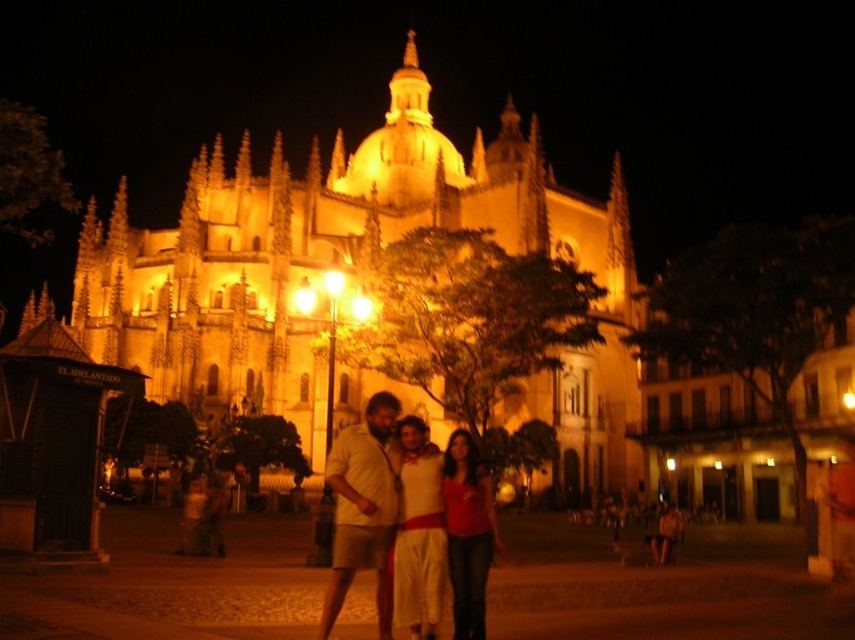
You are a photographer trying to capture a group photo of the white cotton dress at center and the matte beige shirt at center. Which of the two should you focus on first if you want to ensure both are in frame without cropping?

The white cotton dress at center occupies less space than matte beige shirt at center, so you should focus on the matte beige shirt at center first to ensure both fit in the frame.

You are standing in front of the cathedral and see the point marked at coordinates [363,508]. What object is located at that point?

The point at coordinates [363,508] corresponds to the beige cotton shirt at center.